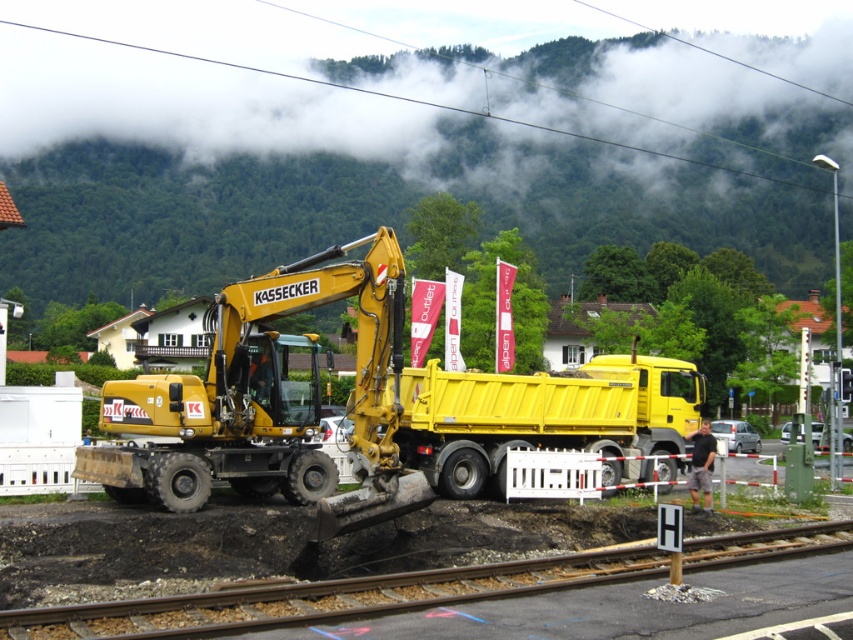
Question: Does yellow matte trailer truck at center appear on the left side of smooth asphalt track at lower center?

Choices:
 (A) no
 (B) yes

Answer: (A)

Question: Can you confirm if yellow rubber excavator at center is thinner than yellow matte trailer truck at center?

Choices:
 (A) no
 (B) yes

Answer: (B)

Question: Is yellow rubber excavator at center to the left of smooth asphalt track at lower center from the viewer's perspective?

Choices:
 (A) no
 (B) yes

Answer: (B)

Question: Which of the following is the closest to the observer?

Choices:
 (A) (219, 634)
 (B) (434, 380)
 (C) (80, 460)

Answer: (A)

Question: Which point is farther to the camera?

Choices:
 (A) yellow matte trailer truck at center
 (B) smooth asphalt track at lower center

Answer: (A)

Question: Which point is farther to the camera?

Choices:
 (A) yellow rubber excavator at center
 (B) yellow matte trailer truck at center
 (C) smooth asphalt track at lower center

Answer: (B)